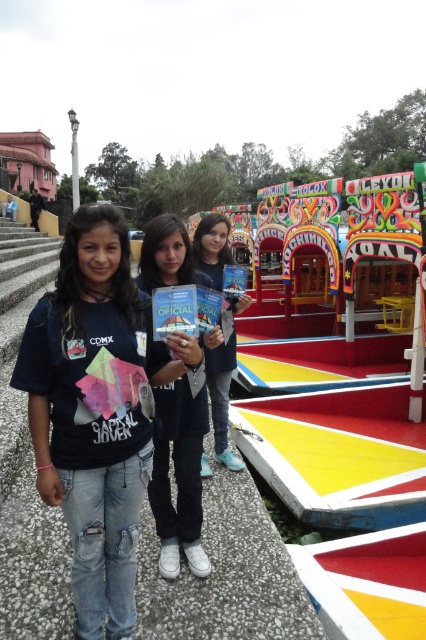
From the picture: How distant is denim jeans at center from matte black jacket at center?

The distance of denim jeans at center from matte black jacket at center is 34.67 inches.

In the scene shown: Does denim jeans at center have a larger size compared to matte black jacket at center?

Indeed, denim jeans at center has a larger size compared to matte black jacket at center.

You are a GUI agent. You are given a task and a screenshot of the screen. Output one action in this format:
    pyautogui.click(x=<x>, y=<y>)
    Task: Click on the denim jeans at center
    This screenshot has height=640, width=426.
    Given the screenshot: What is the action you would take?
    (x=97, y=410)

Consider the image. Does matte black jacket at center have a larger size compared to matte blue jeans at center?

Correct, matte black jacket at center is larger in size than matte blue jeans at center.

Who is more forward, (207, 397) or (218, 234)?

Point (207, 397) is in front.

At what (x,y) coordinates should I click in order to perform the action: click on matte black jacket at center. Please return your answer as a coordinate pair (x, y). The height and width of the screenshot is (640, 426). Looking at the image, I should click on (x=180, y=474).

Can you confirm if denim jeans at center is shorter than matte blue jeans at center?

No, denim jeans at center is not shorter than matte blue jeans at center.

Can you confirm if denim jeans at center is positioned to the right of matte blue jeans at center?

Incorrect, denim jeans at center is not on the right side of matte blue jeans at center.

Which is in front, point (74, 522) or point (219, 458)?

Positioned in front is point (74, 522).

You are a GUI agent. You are given a task and a screenshot of the screen. Output one action in this format:
    pyautogui.click(x=<x>, y=<y>)
    Task: Click on the denim jeans at center
    The height and width of the screenshot is (640, 426).
    Given the screenshot: What is the action you would take?
    pyautogui.click(x=97, y=410)